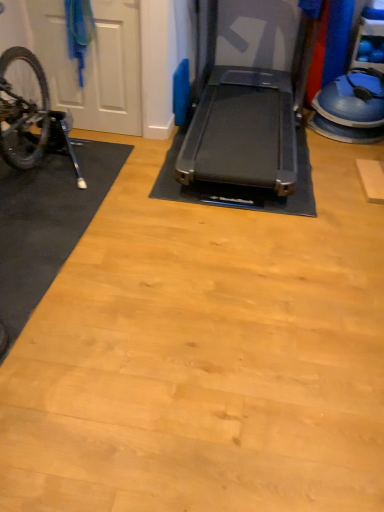
Question: Is white matte door at left surrounding shiny metallic bicycle at left?

Choices:
 (A) no
 (B) yes

Answer: (A)

Question: Considering the relative positions of white matte door at left and shiny metallic bicycle at left in the image provided, is white matte door at left to the right of shiny metallic bicycle at left from the viewer's perspective?

Choices:
 (A) no
 (B) yes

Answer: (B)

Question: Does white matte door at left have a smaller size compared to shiny metallic bicycle at left?

Choices:
 (A) yes
 (B) no

Answer: (A)

Question: Is white matte door at left directly adjacent to shiny metallic bicycle at left?

Choices:
 (A) no
 (B) yes

Answer: (A)

Question: Is white matte door at left turned away from shiny metallic bicycle at left?

Choices:
 (A) yes
 (B) no

Answer: (B)

Question: Based on their sizes in the image, would you say white matte door at left is bigger or smaller than black rubber mat at left?

Choices:
 (A) small
 (B) big

Answer: (A)

Question: Is point (79, 121) closer or farther from the camera than point (19, 226)?

Choices:
 (A) farther
 (B) closer

Answer: (A)

Question: Considering the positions of white matte door at left and black rubber mat at left in the image, is white matte door at left wider or thinner than black rubber mat at left?

Choices:
 (A) thin
 (B) wide

Answer: (A)

Question: Is white matte door at left situated inside black rubber mat at left or outside?

Choices:
 (A) inside
 (B) outside

Answer: (B)

Question: Which is correct: shiny metallic bicycle at left is inside black rubber treadmill at center, or outside of it?

Choices:
 (A) outside
 (B) inside

Answer: (A)

Question: Considering the positions of point (64, 144) and point (291, 144), is point (64, 144) closer or farther from the camera than point (291, 144)?

Choices:
 (A) closer
 (B) farther

Answer: (A)

Question: Is shiny metallic bicycle at left in front of or behind black rubber treadmill at center in the image?

Choices:
 (A) behind
 (B) front

Answer: (A)

Question: From a real-world perspective, is shiny metallic bicycle at left physically located above or below black rubber treadmill at center?

Choices:
 (A) below
 (B) above

Answer: (A)

Question: Is white matte door at left bigger or smaller than shiny metallic bicycle at left?

Choices:
 (A) small
 (B) big

Answer: (A)

Question: From the image's perspective, is white matte door at left located above or below shiny metallic bicycle at left?

Choices:
 (A) below
 (B) above

Answer: (B)